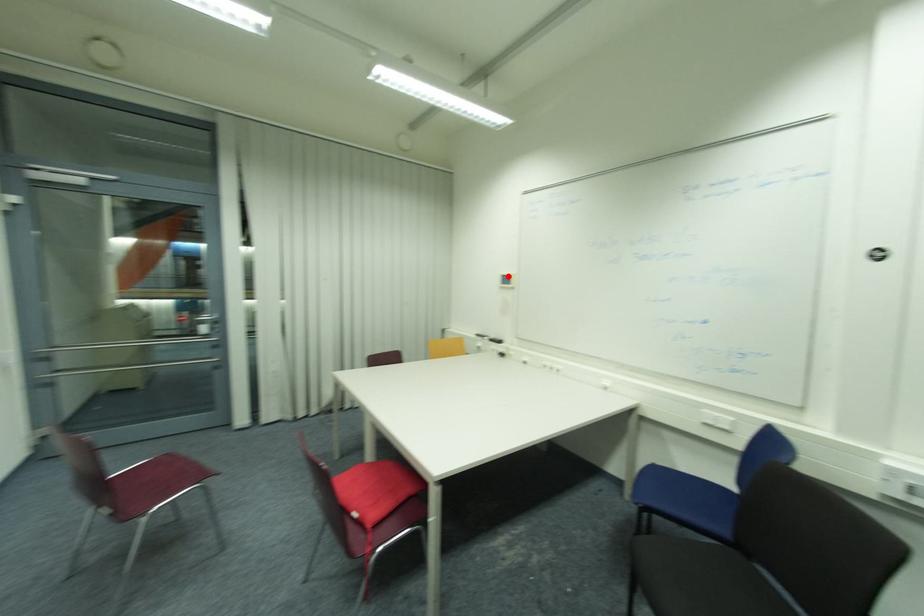
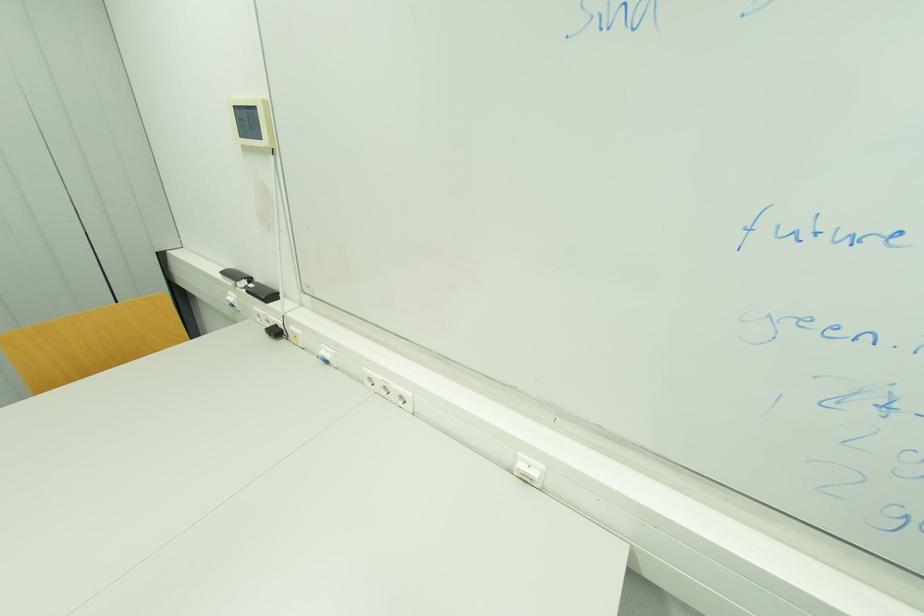
In the second image, find the point that corresponds to the highlighted location in the first image.

(237, 108)